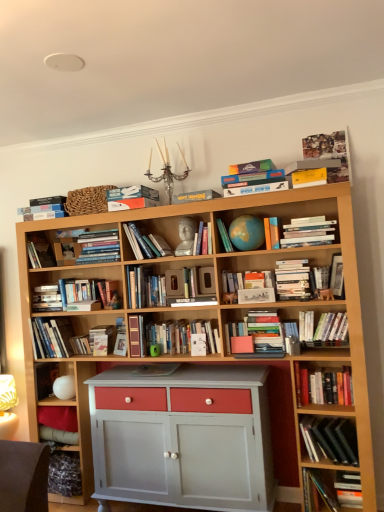
I want to click on blank space above white matte paperback book at center-right, which is counted as the fourth paperback book, starting from the top (from a real-world perspective), so [301, 254].